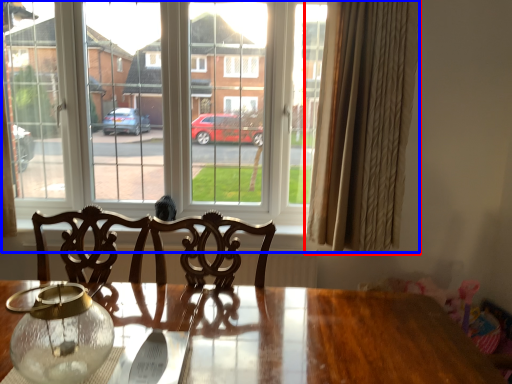
Question: Among these objects, which one is farthest to the camera, curtain (highlighted by a red box) or window (highlighted by a blue box)?

Choices:
 (A) curtain
 (B) window

Answer: (B)